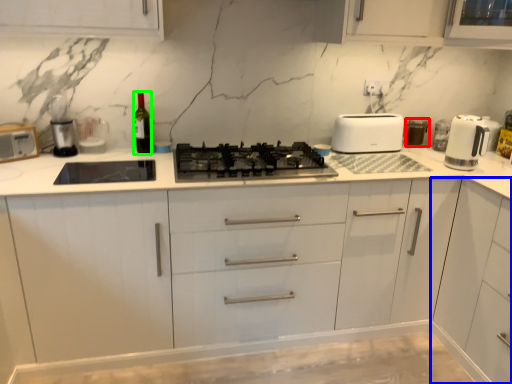
Question: Estimate the real-world distances between objects in this image. Which object is closer to appliance (highlighted by a red box), cabinetry (highlighted by a blue box) or wine bottle (highlighted by a green box)?

Choices:
 (A) cabinetry
 (B) wine bottle

Answer: (A)